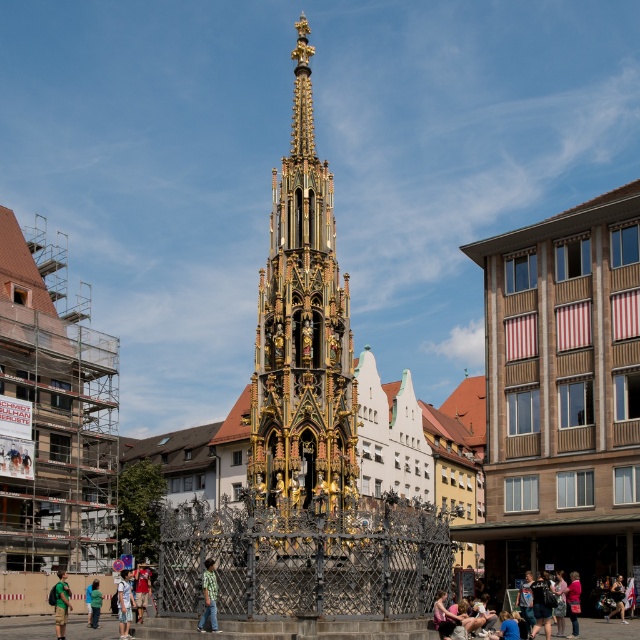
Measure the distance from green fabric shirt at lower left to blue fabric at lower center.

26.74 meters

This screenshot has height=640, width=640. Find the location of `green fabric shirt at lower left`. green fabric shirt at lower left is located at coordinates (61, 604).

At what (x,y) coordinates should I click in order to perform the action: click on green fabric shirt at lower left. Please return your answer as a coordinate pair (x, y). The height and width of the screenshot is (640, 640). Looking at the image, I should click on (61, 604).

Can you confirm if gold/gilded metal tower at center is thinner than green fabric jacket at lower left?

No, gold/gilded metal tower at center is not thinner than green fabric jacket at lower left.

How far apart are gold/gilded metal tower at center and green fabric jacket at lower left?

The distance of gold/gilded metal tower at center from green fabric jacket at lower left is 23.34 meters.

Who is more distant from viewer, (262, 477) or (93, 589)?

The point (262, 477) is more distant.

This screenshot has height=640, width=640. Identify the location of gold/gilded metal tower at center. (301, 336).

Looking at this image, is green fabric shirt at lower left positioned in front of skinny jeans at lower right?

Yes, it is.

Is green fabric shirt at lower left taller than skinny jeans at lower right?

Yes, green fabric shirt at lower left is taller than skinny jeans at lower right.

Locate an element on the screen. The image size is (640, 640). green fabric shirt at lower left is located at coordinates (61, 604).